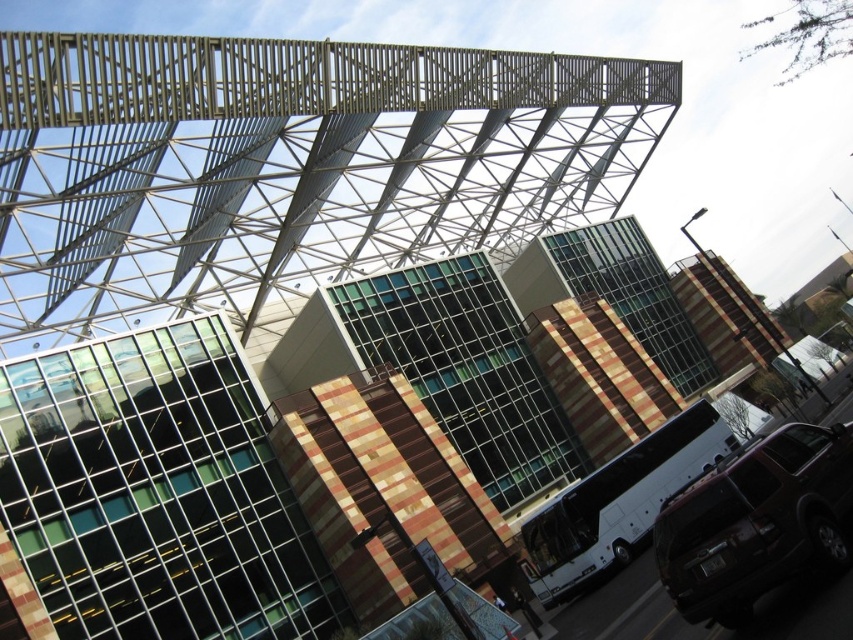
Question: Which point is farther to the camera?

Choices:
 (A) shiny black suv at lower right
 (B) white metallic bus at center

Answer: (B)

Question: Does shiny black suv at lower right lie in front of white metallic bus at center?

Choices:
 (A) yes
 (B) no

Answer: (A)

Question: Which of the following is the closest to the observer?

Choices:
 (A) pyautogui.click(x=740, y=486)
 (B) pyautogui.click(x=619, y=520)

Answer: (A)

Question: Can you confirm if shiny black suv at lower right is positioned to the left of white metallic bus at center?

Choices:
 (A) yes
 (B) no

Answer: (B)

Question: Does shiny black suv at lower right appear under white metallic bus at center?

Choices:
 (A) no
 (B) yes

Answer: (A)

Question: Which of the following is the closest to the observer?

Choices:
 (A) white metallic bus at center
 (B) shiny black suv at lower right

Answer: (B)